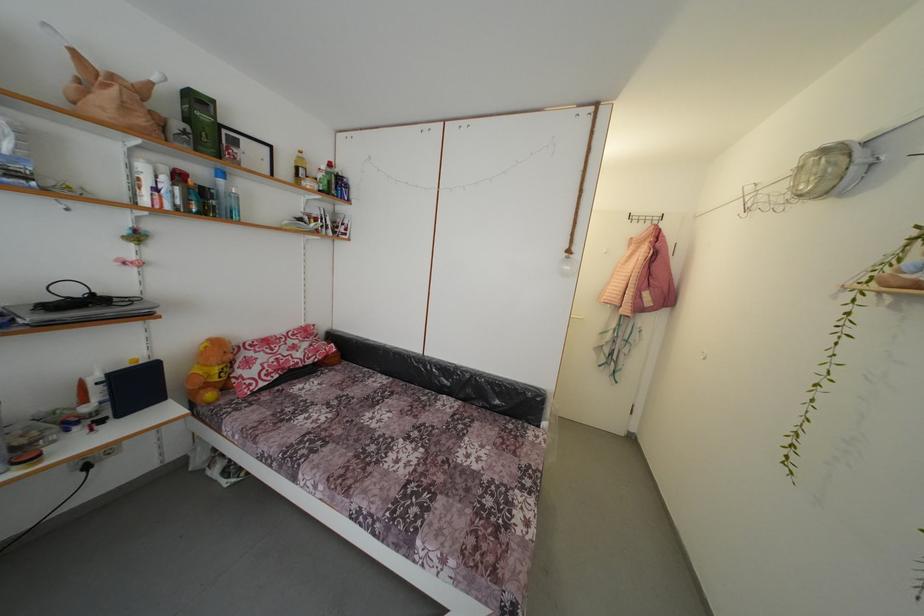
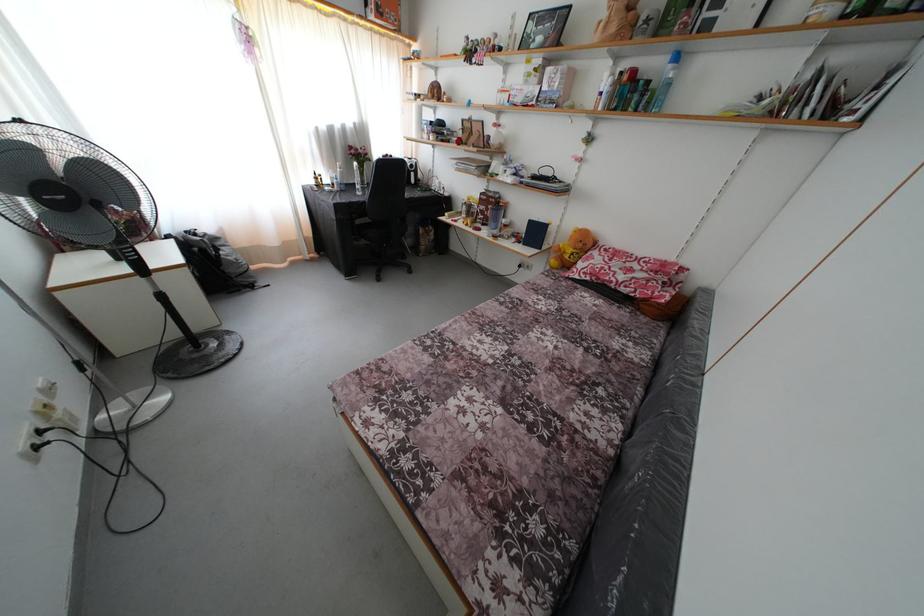
The point at (240, 416) is marked in the first image. Where is the corresponding point in the second image?

(552, 282)